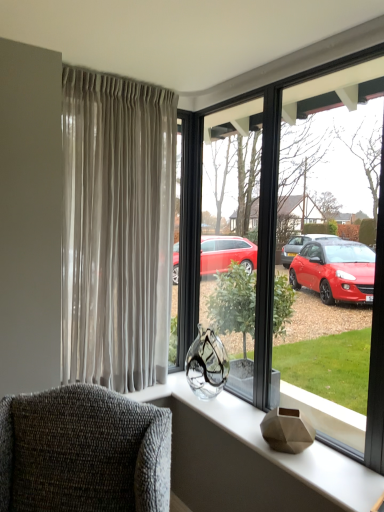
Identify the location of free space above satin beige curtains at left (from a real-world perspective). (123, 76).